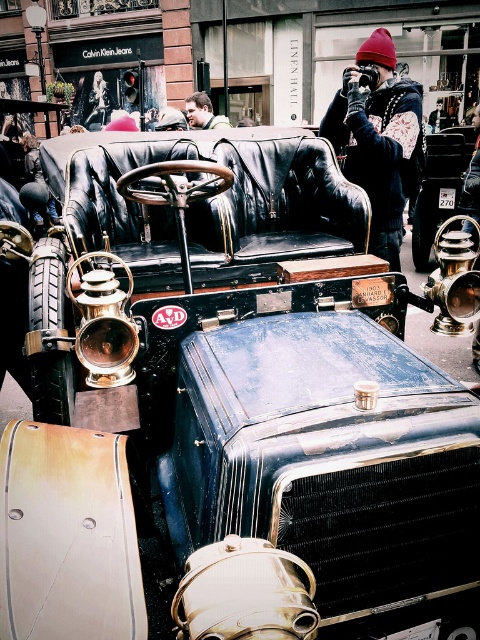
Question: Which object appears closest to the camera in this image?

Choices:
 (A) smooth skin face at upper center
 (B) red knit beanie at upper center

Answer: (B)

Question: Can you confirm if red knit beanie at upper center is thinner than smooth skin face at upper center?

Choices:
 (A) no
 (B) yes

Answer: (A)

Question: Is red knit beanie at upper center closer to camera compared to smooth skin face at upper center?

Choices:
 (A) no
 (B) yes

Answer: (B)

Question: Does red knit beanie at upper center come in front of smooth skin face at upper center?

Choices:
 (A) no
 (B) yes

Answer: (B)

Question: Which point is farther to the camera?

Choices:
 (A) (190, 122)
 (B) (372, 40)

Answer: (A)